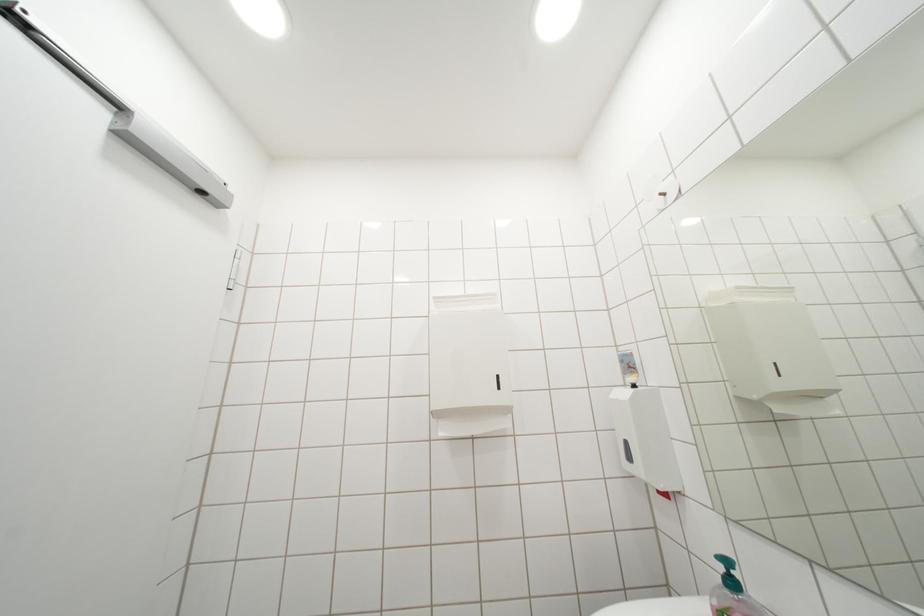
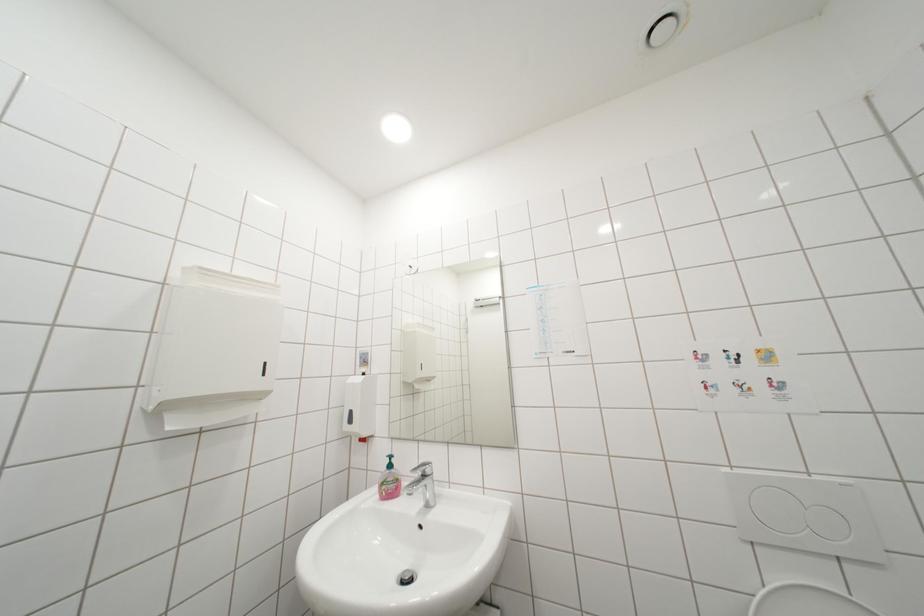
Question: The camera is either moving clockwise (left) or counter-clockwise (right) around the object. The first image is from the beginning of the video and the second image is from the end. Is the camera moving left or right when shooting the video?

Choices:
 (A) Left
 (B) Right

Answer: (A)